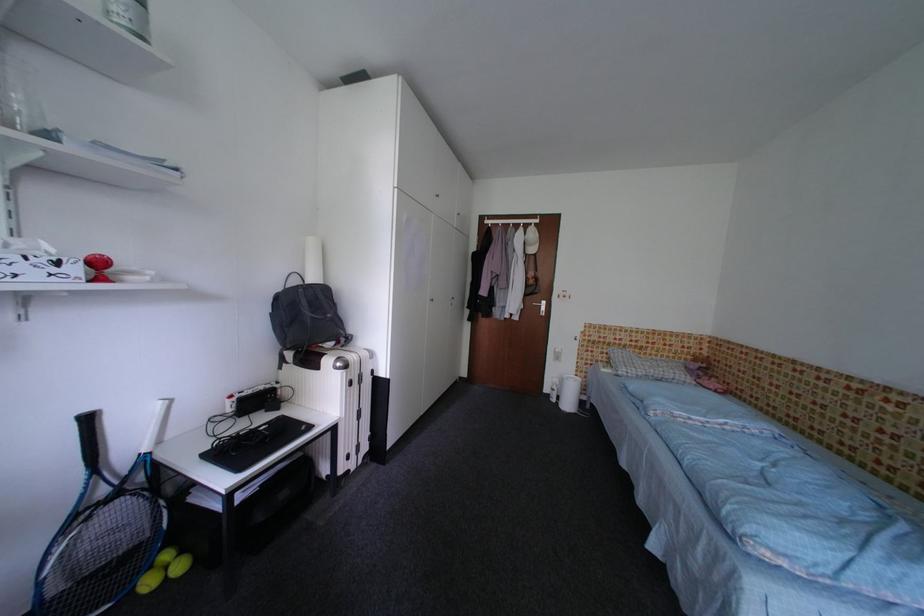
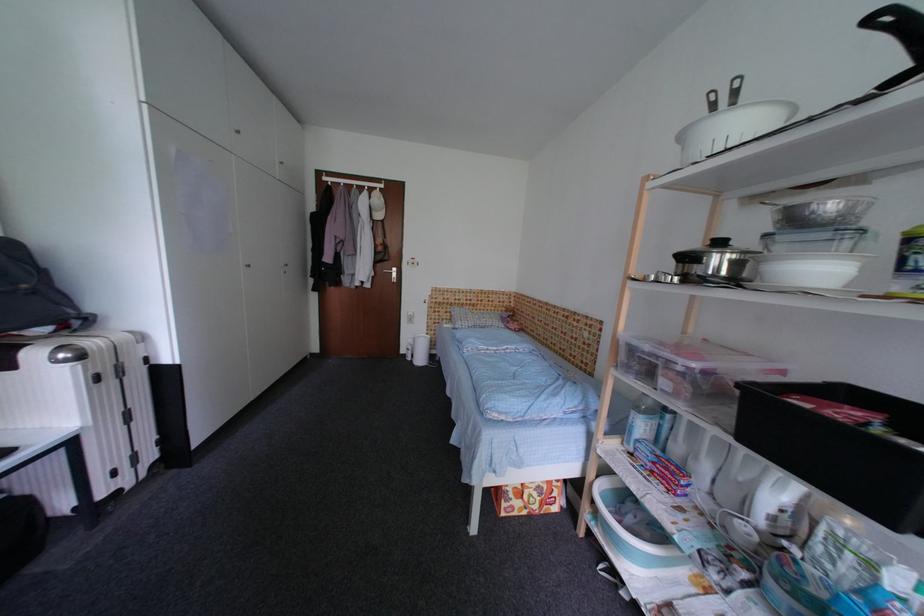
Question: The camera is either moving clockwise (left) or counter-clockwise (right) around the object. The first image is from the beginning of the video and the second image is from the end. Is the camera moving left or right when shooting the video?

Choices:
 (A) Left
 (B) Right

Answer: (A)